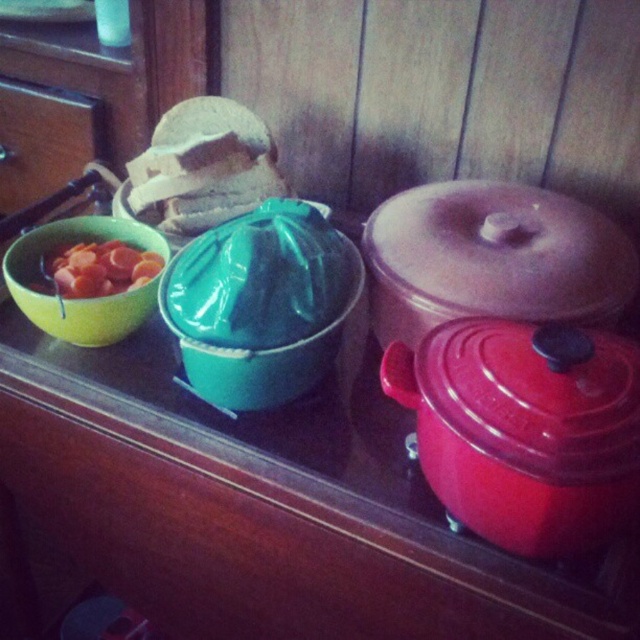
Question: Which object is farther from the camera taking this photo?

Choices:
 (A) matte green juicer at center
 (B) bread-like object at upper left
 (C) matte green bowl at left
 (D) smooth orange slices at left

Answer: (B)

Question: From the image, what is the correct spatial relationship of matte green juicer at center in relation to matte green bowl at left?

Choices:
 (A) left
 (B) right

Answer: (B)

Question: Considering the relative positions of bread-like object at upper left and smooth orange slices at left in the image provided, where is bread-like object at upper left located with respect to smooth orange slices at left?

Choices:
 (A) above
 (B) below

Answer: (A)

Question: Which point is farther to the camera?

Choices:
 (A) (84, 301)
 (B) (182, 173)
 (C) (68, 257)
 (D) (198, 364)

Answer: (B)

Question: Is bread-like object at upper left closer to the viewer compared to matte green juicer at center?

Choices:
 (A) no
 (B) yes

Answer: (A)

Question: Which is nearer to the bread-like object at upper left?

Choices:
 (A) matte green bowl at left
 (B) matte green juicer at center

Answer: (A)